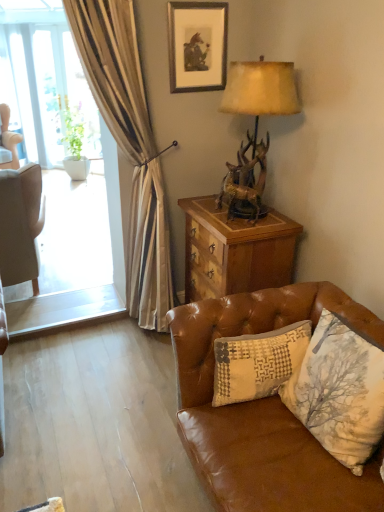
Question: From a real-world perspective, is brown leather couch at lower right located higher than antler-patterned wood lamp at upper right?

Choices:
 (A) yes
 (B) no

Answer: (B)

Question: Is antler-patterned wood lamp at upper right located within brown leather couch at lower right?

Choices:
 (A) yes
 (B) no

Answer: (B)

Question: Is brown leather couch at lower right far away from antler-patterned wood lamp at upper right?

Choices:
 (A) no
 (B) yes

Answer: (B)

Question: Is brown leather couch at lower right turned away from antler-patterned wood lamp at upper right?

Choices:
 (A) no
 (B) yes

Answer: (A)

Question: Does brown leather couch at lower right appear on the right side of antler-patterned wood lamp at upper right?

Choices:
 (A) yes
 (B) no

Answer: (A)

Question: In terms of height, does matte black picture frame at upper center look taller or shorter compared to antler-patterned wood lamp at upper right?

Choices:
 (A) short
 (B) tall

Answer: (A)

Question: Is matte black picture frame at upper center inside the boundaries of antler-patterned wood lamp at upper right, or outside?

Choices:
 (A) inside
 (B) outside

Answer: (B)

Question: Is matte black picture frame at upper center bigger or smaller than antler-patterned wood lamp at upper right?

Choices:
 (A) big
 (B) small

Answer: (B)

Question: In terms of width, does matte black picture frame at upper center look wider or thinner when compared to antler-patterned wood lamp at upper right?

Choices:
 (A) wide
 (B) thin

Answer: (B)

Question: Would you say brown leather couch at lower right is to the left or to the right of matte black picture frame at upper center in the picture?

Choices:
 (A) left
 (B) right

Answer: (B)

Question: From a real-world perspective, is brown leather couch at lower right physically located above or below matte black picture frame at upper center?

Choices:
 (A) above
 (B) below

Answer: (B)

Question: In terms of width, does brown leather couch at lower right look wider or thinner when compared to matte black picture frame at upper center?

Choices:
 (A) thin
 (B) wide

Answer: (B)

Question: Relative to matte black picture frame at upper center, is brown leather couch at lower right in front or behind?

Choices:
 (A) front
 (B) behind

Answer: (A)

Question: Is wooden chest at right in front of or behind matte black picture frame at upper center in the image?

Choices:
 (A) front
 (B) behind

Answer: (A)

Question: Does point (274, 274) appear closer or farther from the camera than point (216, 55)?

Choices:
 (A) closer
 (B) farther

Answer: (A)